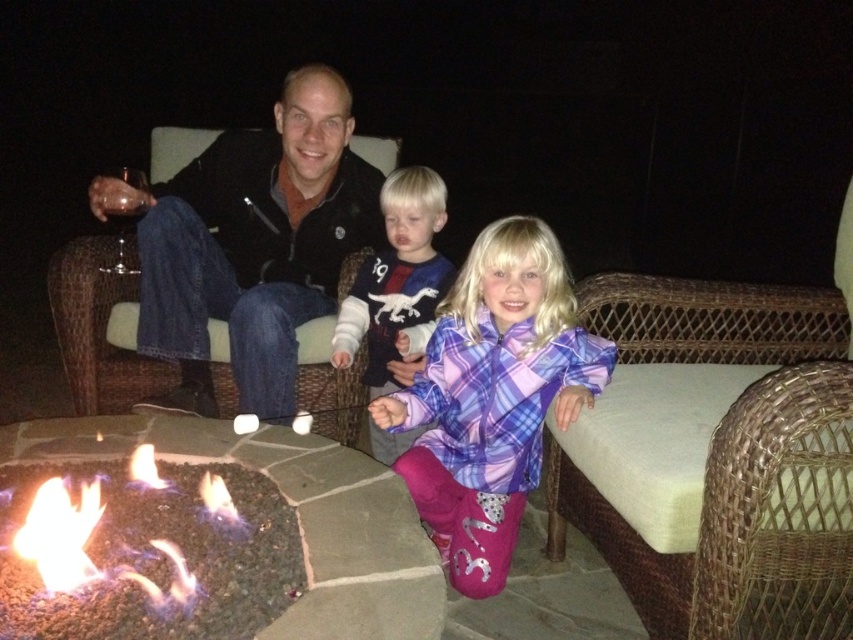
Does plush fleece sweater at center appear on the right side of flamegasfire at lower left?

Indeed, plush fleece sweater at center is positioned on the right side of flamegasfire at lower left.

At what (x,y) coordinates should I click in order to perform the action: click on plush fleece sweater at center. Please return your answer as a coordinate pair (x, y). The width and height of the screenshot is (853, 640). Looking at the image, I should click on (397, 284).

In the scene shown: Can you confirm if dark blue jeans at center is bigger than flamegasfire at lower left?

Yes.

Which is more to the left, dark blue jeans at center or flamegasfire at lower left?

From the viewer's perspective, flamegasfire at lower left appears more on the left side.

Where is `dark blue jeans at center`? This screenshot has height=640, width=853. dark blue jeans at center is located at coordinates (254, 244).

Where is `dark blue jeans at center`? The width and height of the screenshot is (853, 640). dark blue jeans at center is located at coordinates click(254, 244).

Does point (184, 237) come closer to viewer compared to point (482, 256)?

No, (184, 237) is further to viewer.

Where is `dark blue jeans at center`? dark blue jeans at center is located at coordinates (254, 244).